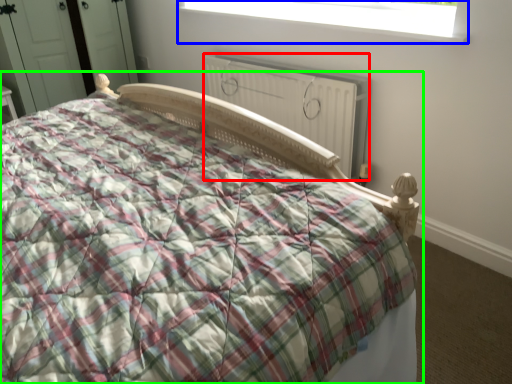
Question: Which object is the farthest from radiator (highlighted by a red box)? Choose among these: window (highlighted by a blue box) or bed (highlighted by a green box).

Choices:
 (A) window
 (B) bed

Answer: (B)